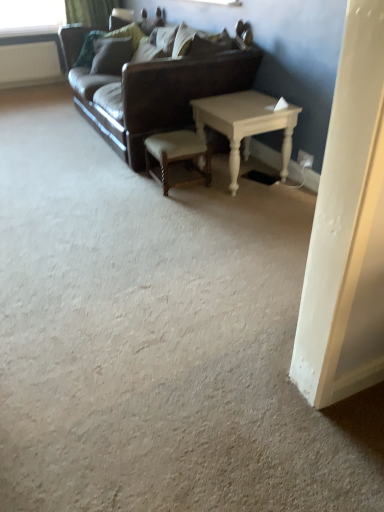
Where is `free space in front of leather couch at center`? This screenshot has width=384, height=512. free space in front of leather couch at center is located at coordinates (127, 210).